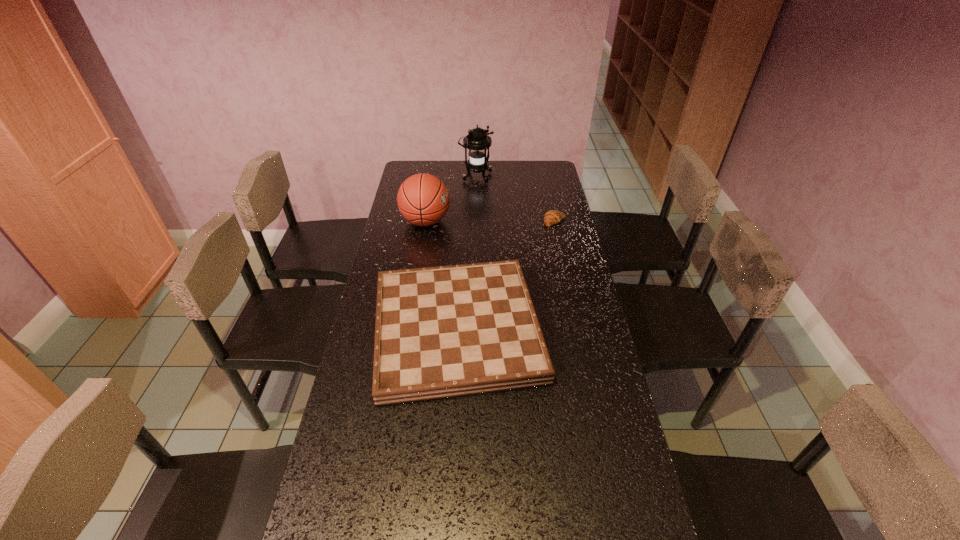
The image size is (960, 540). What are the coordinates of `vacant space situated 0.060m on the left of the shortest object` in the screenshot? It's located at (529, 221).

I want to click on object that is positioned at the far edge, so click(477, 141).

This screenshot has width=960, height=540. I want to click on basketball that is at the left edge, so click(x=423, y=199).

Identify the location of gameboard at the left edge. (442, 332).

You are a GUI agent. You are given a task and a screenshot of the screen. Output one action in this format:
    pyautogui.click(x=<x>, y=<y>)
    Task: Click on the object situated at the right edge
    The height and width of the screenshot is (540, 960).
    Given the screenshot: What is the action you would take?
    point(552,217)

Locate an element on the screen. The height and width of the screenshot is (540, 960). vacant region at the far edge of the desktop is located at coordinates (516, 163).

Find the location of a particular element. vacant space at the left edge is located at coordinates (370, 329).

You are a GUI agent. You are given a task and a screenshot of the screen. Output one action in this format:
    pyautogui.click(x=<x>, y=<y>)
    Task: Click on the free space at the right edge of the desktop
    
    Given the screenshot: What is the action you would take?
    pyautogui.click(x=539, y=208)

In the image, there is a desktop. At what (x,y) coordinates should I click in order to perform the action: click on free space at the far left corner. Please return your answer as a coordinate pair (x, y). Looking at the image, I should click on (407, 161).

Where is `vacant area between the lantern and the gameboard`? The height and width of the screenshot is (540, 960). vacant area between the lantern and the gameboard is located at coordinates (467, 254).